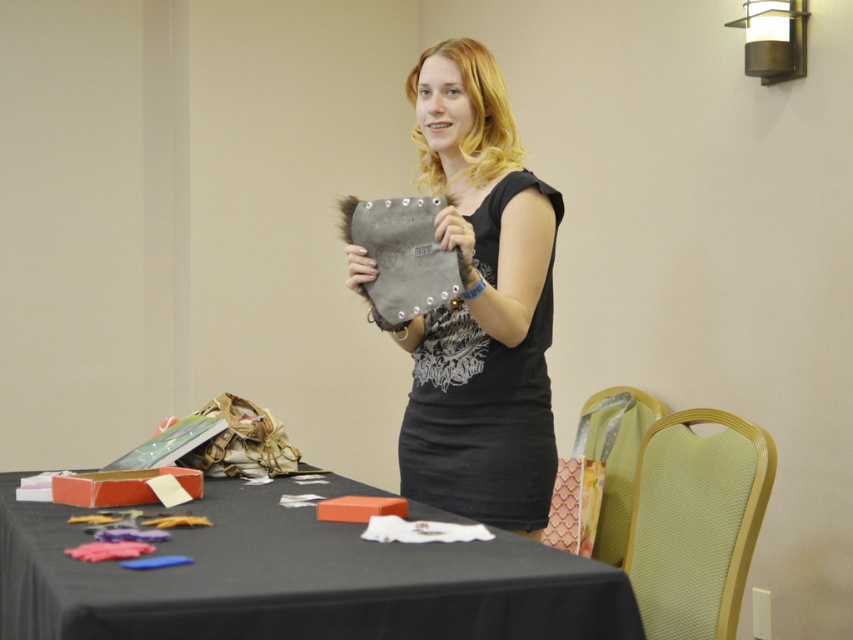
You are organizing a fashion show and need to place the matte gray pouch at center on the black fabric table at lower left. Given their sizes, will the pouch fit on the table without overhanging the edges?

The black fabric table at lower left is wider than the matte gray pouch at center, so the pouch will fit on the table without overhanging the edges.

You are a photographer setting up for a photoshoot. You need to adjust the lighting so that the matte gray pouch at center is illuminated more than the black fabric table at lower left. Which object should you move closer to the light source?

The matte gray pouch at center should be moved closer to the light source because the black fabric table at lower left is already closer to the viewer, so moving the pouch closer would ensure it receives more light.